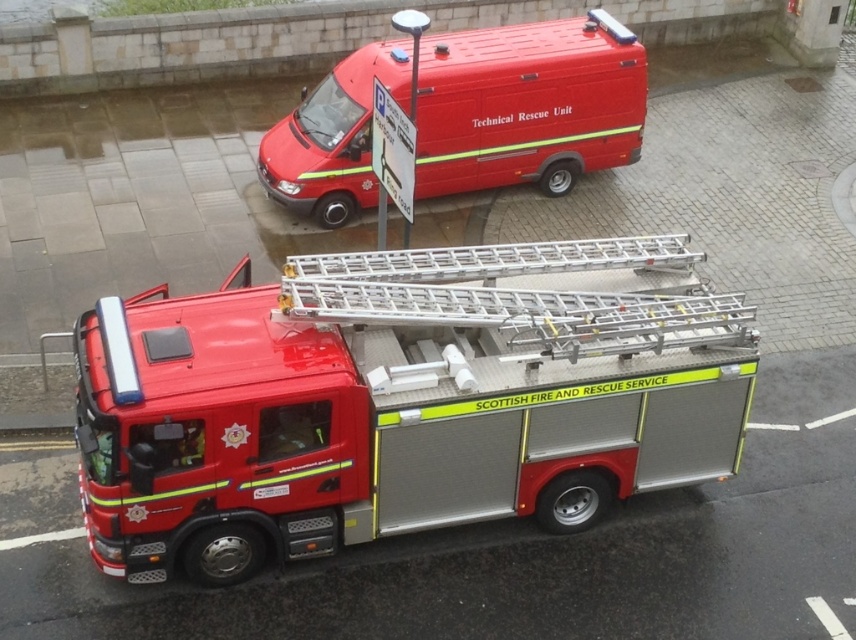
Question: Which object appears closest to the camera in this image?

Choices:
 (A) silver/aluminum ladder at center
 (B) metallic silver fire truck at center
 (C) metallic red van at upper center

Answer: (A)

Question: Is metallic red van at upper center closer to camera compared to silver/aluminum ladder at center?

Choices:
 (A) no
 (B) yes

Answer: (A)

Question: Is the position of metallic silver fire truck at center less distant than that of metallic red van at upper center?

Choices:
 (A) no
 (B) yes

Answer: (B)

Question: Can you confirm if metallic silver fire truck at center is positioned above silver/aluminum ladder at center?

Choices:
 (A) yes
 (B) no

Answer: (B)

Question: Which of the following is the closest to the observer?

Choices:
 (A) (316, 512)
 (B) (399, 83)
 (C) (544, 353)

Answer: (C)

Question: Which of the following is the farthest from the observer?

Choices:
 (A) (444, 122)
 (B) (283, 320)
 (C) (437, 282)

Answer: (A)